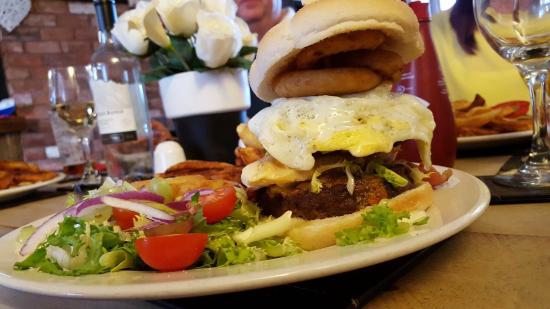
Find the location of `white plate`. white plate is located at coordinates (320, 260).